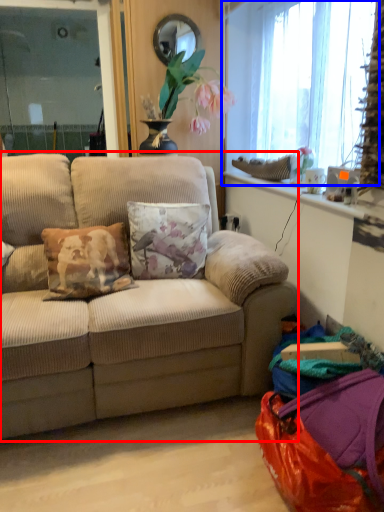
Question: Which object appears farthest to the camera in this image, studio couch (highlighted by a red box) or window (highlighted by a blue box)?

Choices:
 (A) studio couch
 (B) window

Answer: (B)